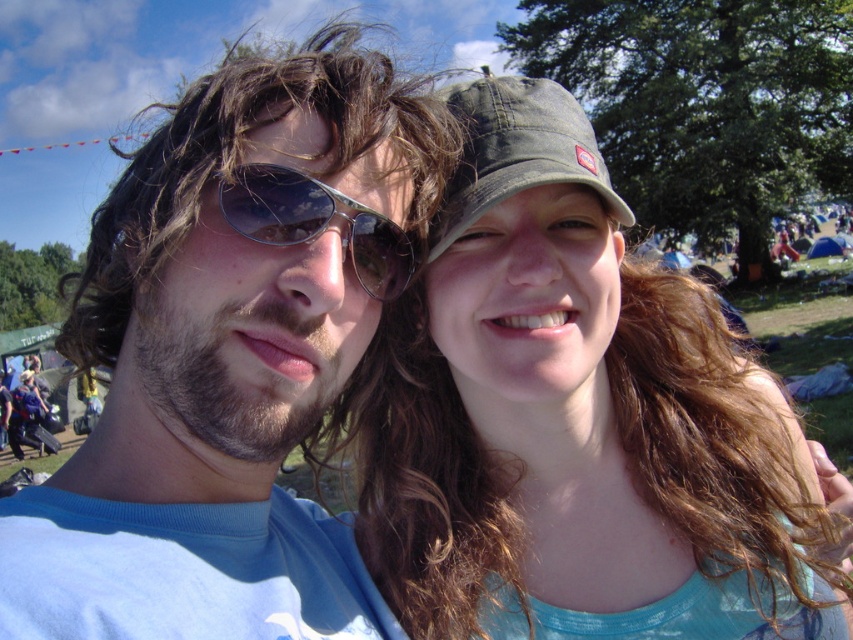
Is point (519, 552) positioned after point (503, 179)?

Yes, it is behind point (503, 179).

Is matte green cap at upper right above green matte baseball cap at upper right?

No, matte green cap at upper right is not above green matte baseball cap at upper right.

What do you see at coordinates (579, 420) in the screenshot?
I see `matte green cap at upper right` at bounding box center [579, 420].

Where is `matte green cap at upper right`? matte green cap at upper right is located at coordinates (579, 420).

You are a GUI agent. You are given a task and a screenshot of the screen. Output one action in this format:
    pyautogui.click(x=<x>, y=<y>)
    Task: Click on the matte blue shirt at center
    
    Given the screenshot: What is the action you would take?
    pyautogui.click(x=241, y=362)

Is matte blue shirt at center to the left of sunglasses at center from the viewer's perspective?

Yes, matte blue shirt at center is to the left of sunglasses at center.

Locate an element on the screen. The height and width of the screenshot is (640, 853). matte blue shirt at center is located at coordinates (241, 362).

Between point (440, 157) and point (590, 173), which one is positioned in front?

Point (440, 157) is in front.

The width and height of the screenshot is (853, 640). What are the coordinates of `matte blue shirt at center` in the screenshot? It's located at (241, 362).